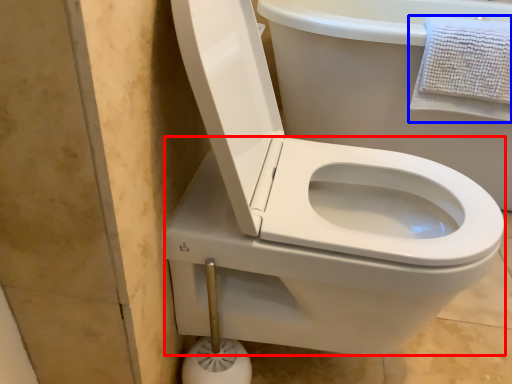
Question: Among these objects, which one is farthest to the camera, bidet (highlighted by a red box) or bath towel (highlighted by a blue box)?

Choices:
 (A) bidet
 (B) bath towel

Answer: (B)